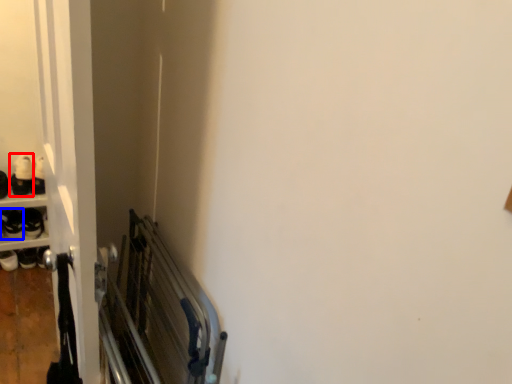
Question: Among these objects, which one is farthest to the camera, footwear (highlighted by a red box) or footwear (highlighted by a blue box)?

Choices:
 (A) footwear
 (B) footwear

Answer: (A)